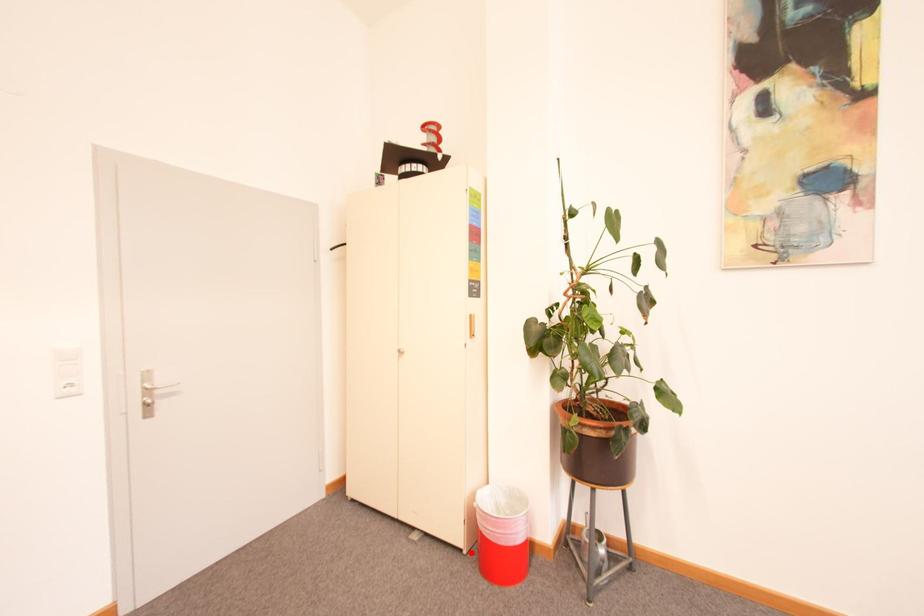
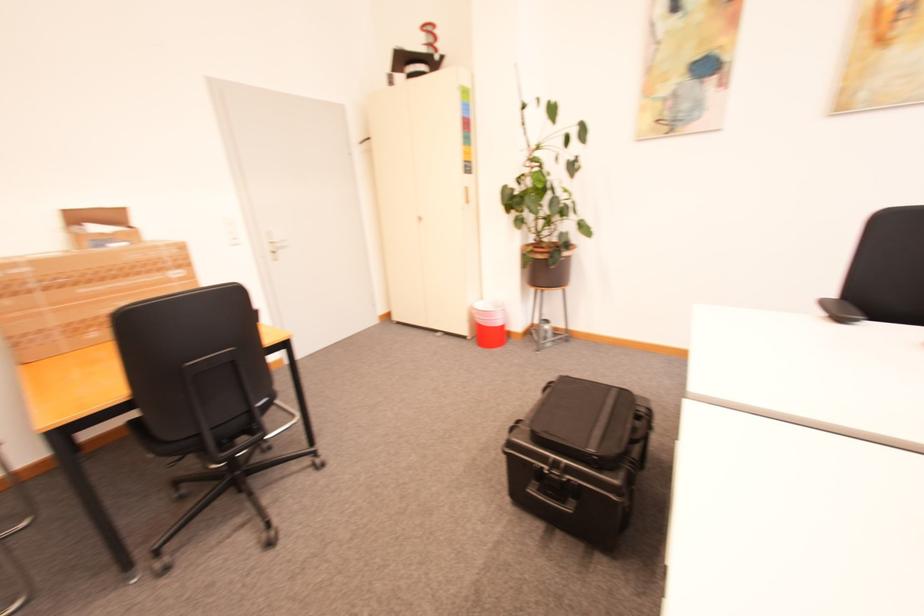
Question: I am providing you with two images of the same scene from different viewpoints. Given a red point in image1, look at the same physical point in image2. Is it:

Choices:
 (A) Closer to the viewpoint
 (B) Farther from the viewpoint

Answer: (A)